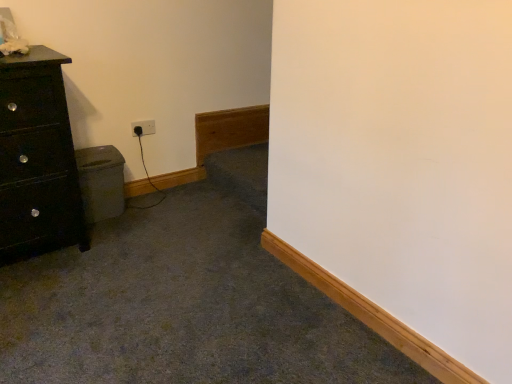
The width and height of the screenshot is (512, 384). What do you see at coordinates (143, 128) in the screenshot?
I see `white plastic outlet at center` at bounding box center [143, 128].

What are the coordinates of `white plastic outlet at center` in the screenshot? It's located at (143, 128).

This screenshot has height=384, width=512. What are the coordinates of `white plastic outlet at center` in the screenshot? It's located at (143, 128).